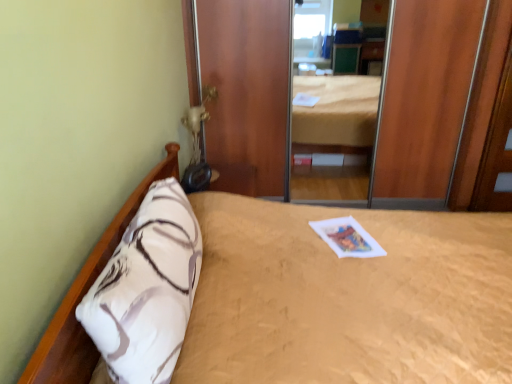
The height and width of the screenshot is (384, 512). I want to click on free spot above white paper magazine at center (from a real-world perspective), so click(x=340, y=231).